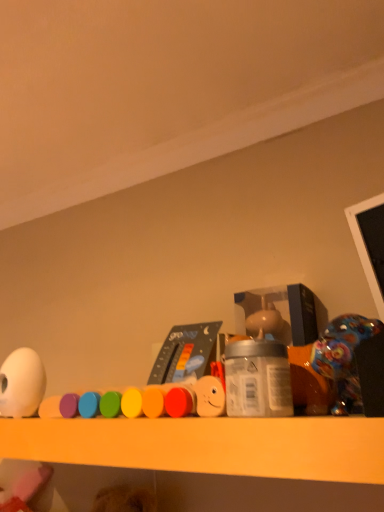
Question: From their relative heights in the image, would you say smooth plastic toy at center, marked as the 2th toy in a right-to-left arrangement, is taller or shorter than shiny plastic toy at right, placed as the 1th toy when sorted from right to left?

Choices:
 (A) tall
 (B) short

Answer: (B)

Question: From a real-world perspective, is smooth plastic toy at center, which is counted as the second toy, starting from the left, positioned above or below shiny plastic toy at right, placed as the 1th toy when sorted from right to left?

Choices:
 (A) above
 (B) below

Answer: (B)

Question: Estimate the real-world distances between objects in this image. Which object is farther from the shiny plastic toy at right, arranged as the third toy when viewed from the left?

Choices:
 (A) white matte egg at left, which is the first toy from left to right
 (B) smooth plastic toy at center, marked as the 2th toy in a right-to-left arrangement
 (C) silver metallic jar at center

Answer: (A)

Question: Which is farther from the shiny plastic toy at right, placed as the 1th toy when sorted from right to left?

Choices:
 (A) silver metallic jar at center
 (B) white matte egg at left, arranged as the third toy when viewed from the right
 (C) smooth plastic toy at center, marked as the 2th toy in a right-to-left arrangement

Answer: (B)